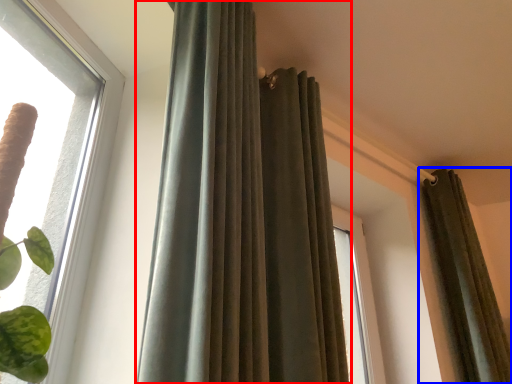
Question: Among these objects, which one is farthest to the camera, curtain (highlighted by a red box) or curtain (highlighted by a blue box)?

Choices:
 (A) curtain
 (B) curtain

Answer: (B)